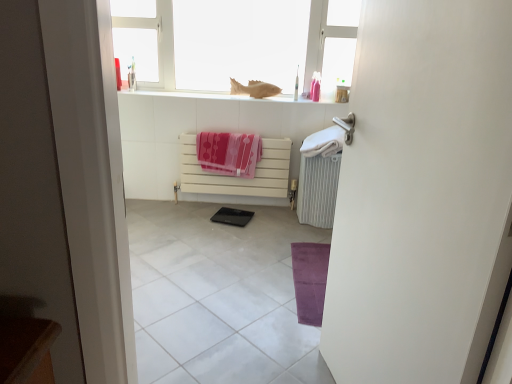
This screenshot has height=384, width=512. Find the location of `vacant area that lies in front of purple velvety yoga mat at lower right`. vacant area that lies in front of purple velvety yoga mat at lower right is located at coordinates (272, 336).